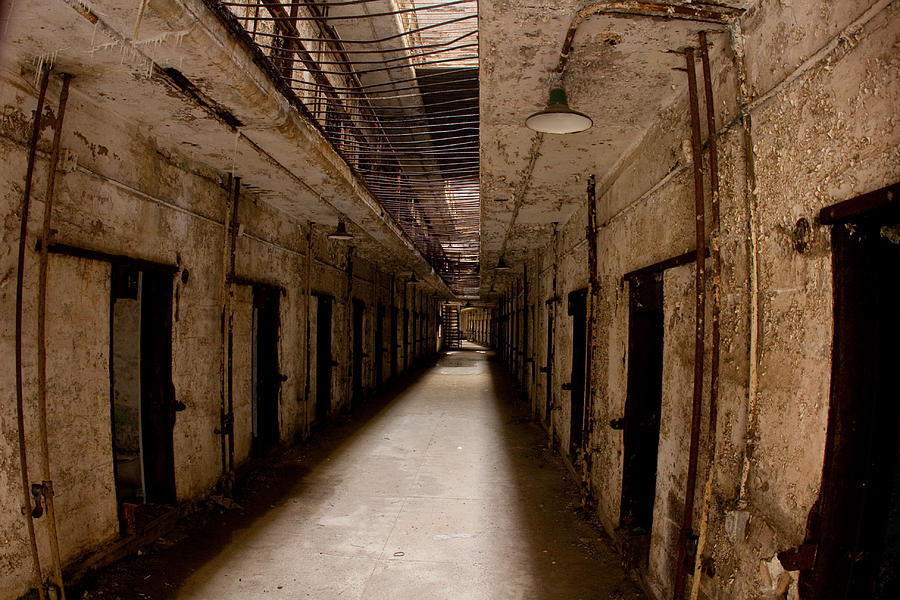
I want to click on lamp, so click(x=555, y=118).